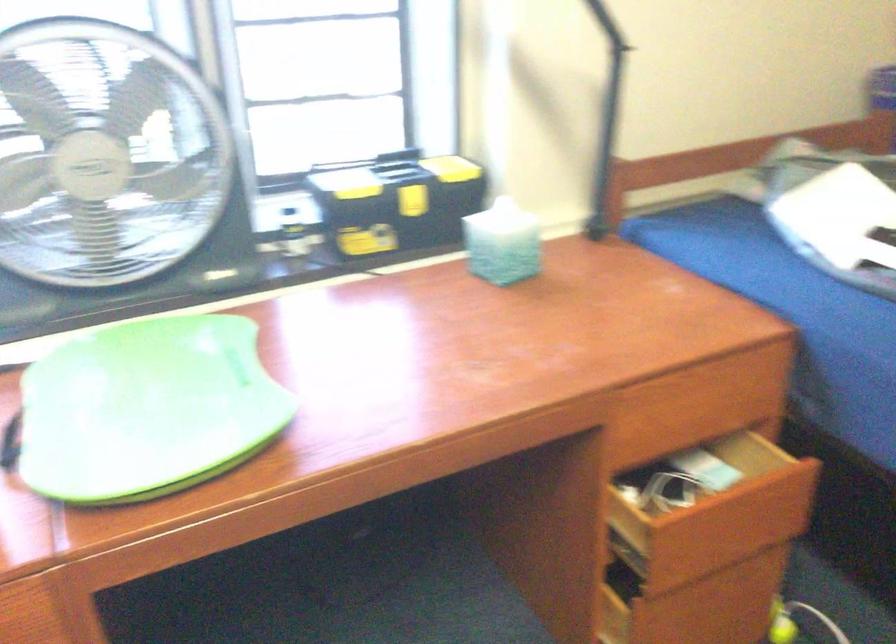
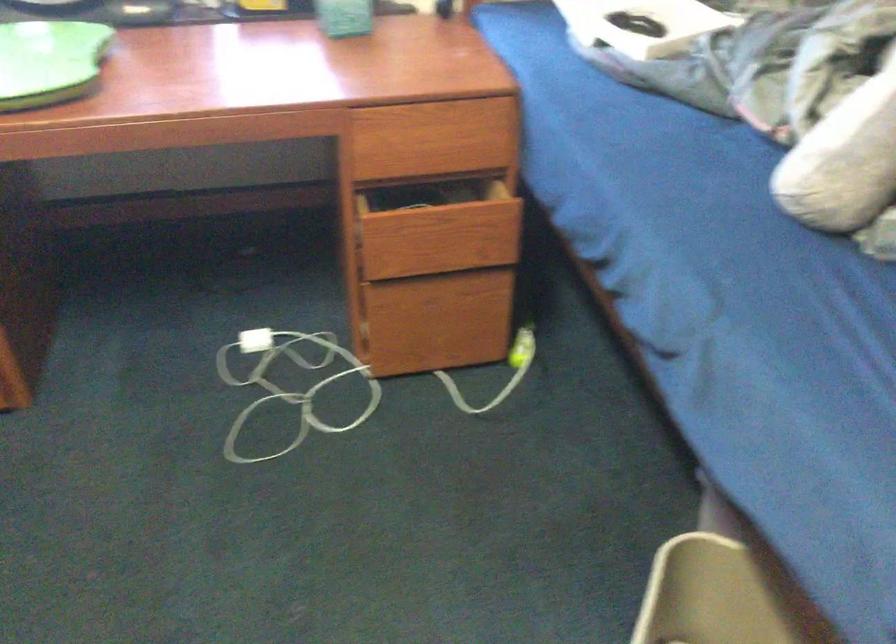
Question: How did the camera likely rotate?

Choices:
 (A) Left
 (B) Right
 (C) Up
 (D) Down

Answer: (D)